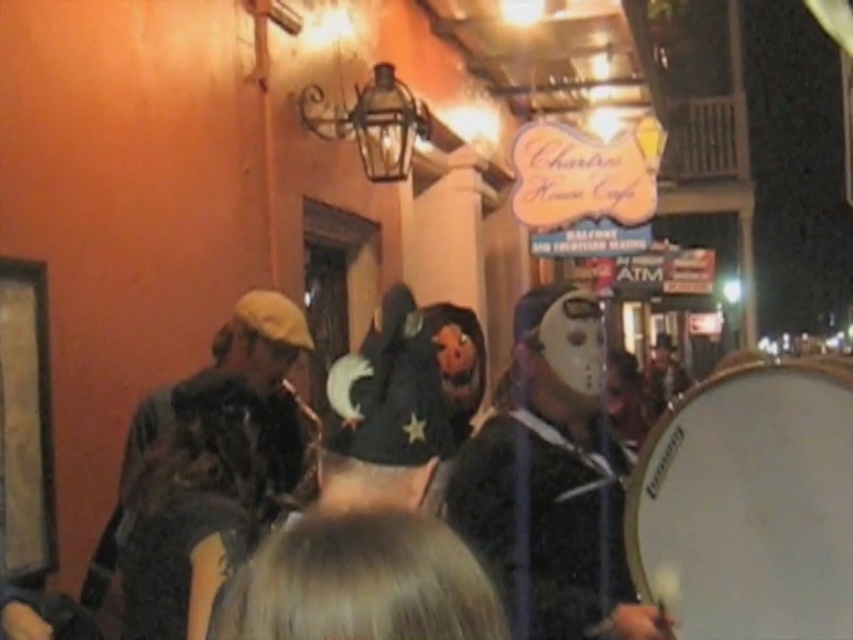
You are a street performer who needs to carry both the white drum at right and the dark brown leather jacket at left. Which item should you carry first if you want to pick up the smaller one first?

The white drum at right is smaller than the dark brown leather jacket at left, so you should carry the white drum at right first.

You are a street performer who needs to move your equipment. You have a dark brown leather jacket at left and a matte black drum at right. Which item is closer to the left side of the alleyway?

The dark brown leather jacket at left is closer to the left side of the alleyway because it is positioned to the left of the matte black drum at right.

Based on the photo, you are a street performer who needs to set up your equipment. You have a dark brown leather jacket at left and a matte black drum at right. Which object is taller and needs more vertical space?

The dark brown leather jacket at left is taller than the matte black drum at right, so it requires more vertical space.